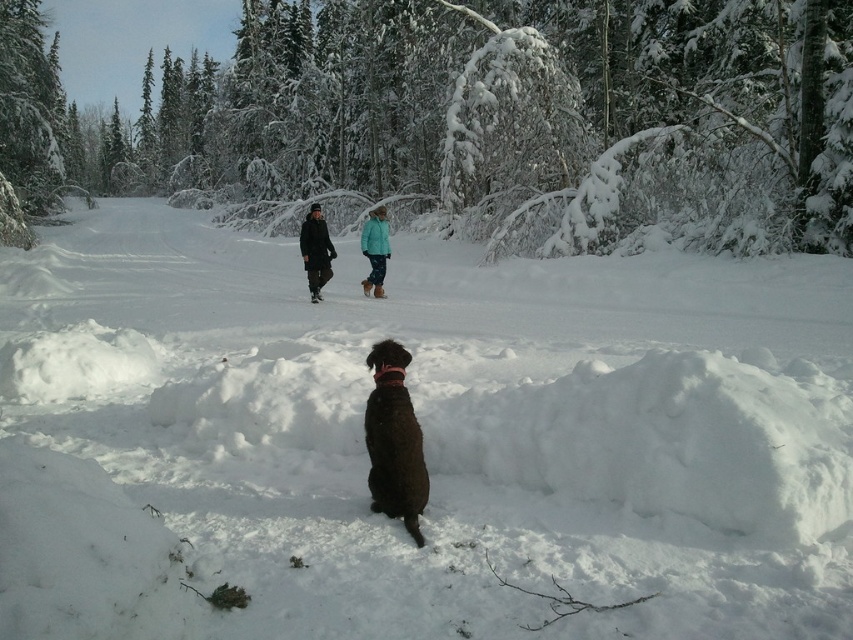
Does dark brown coat at center have a lesser width compared to teal fabric jacket at center?

Incorrect, dark brown coat at center's width is not less than teal fabric jacket at center's.

Which is more to the left, dark brown coat at center or teal fabric jacket at center?

dark brown coat at center

The width and height of the screenshot is (853, 640). Describe the element at coordinates (315, 250) in the screenshot. I see `dark brown coat at center` at that location.

The image size is (853, 640). Find the location of `dark brown coat at center`. dark brown coat at center is located at coordinates (315, 250).

Is white fluffy snow at center taller than snow-covered evergreen tree at center?

In fact, white fluffy snow at center may be shorter than snow-covered evergreen tree at center.

How distant is white fluffy snow at center from snow-covered evergreen tree at center?

A distance of 25.51 meters exists between white fluffy snow at center and snow-covered evergreen tree at center.

Locate an element on the screen. white fluffy snow at center is located at coordinates (424, 440).

Is white fluffy snow at center shorter than brown furry dog at lower center?

Result: In fact, white fluffy snow at center may be taller than brown furry dog at lower center.

Is white fluffy snow at center above brown furry dog at lower center?

Indeed, white fluffy snow at center is positioned over brown furry dog at lower center.

Which is behind, point (236, 481) or point (416, 483)?

Positioned behind is point (236, 481).

This screenshot has width=853, height=640. I want to click on white fluffy snow at center, so click(424, 440).